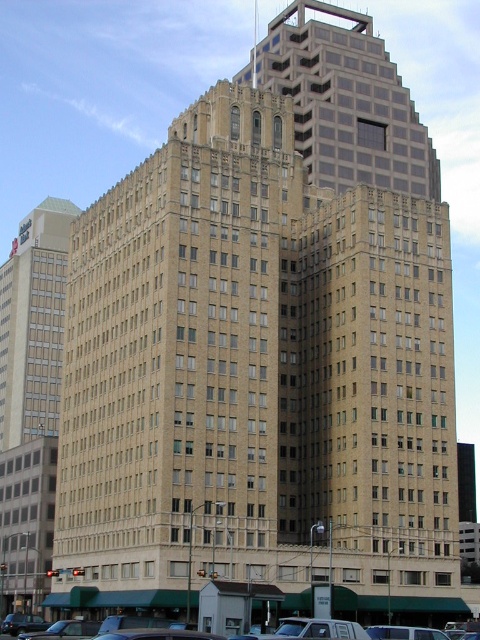
Question: Can you confirm if brown brick building at upper center is positioned to the left of silver metallic sedan at center?

Choices:
 (A) no
 (B) yes

Answer: (A)

Question: Can you confirm if beige brick building at left is positioned below silver metallic sedan at center?

Choices:
 (A) no
 (B) yes

Answer: (A)

Question: Which of the following is the farthest from the observer?

Choices:
 (A) click(36, 413)
 (B) click(452, 625)
 (C) click(409, 141)

Answer: (A)

Question: Which point is farther from the camera taking this photo?

Choices:
 (A) (311, 173)
 (B) (478, 628)
 (C) (25, 364)

Answer: (C)

Question: Which point appears farthest from the camera in this image?

Choices:
 (A) (455, 634)
 (B) (253, 72)

Answer: (B)

Question: Where is beige brick building at left located in relation to silver metallic sedan at center in the image?

Choices:
 (A) left
 (B) right

Answer: (A)